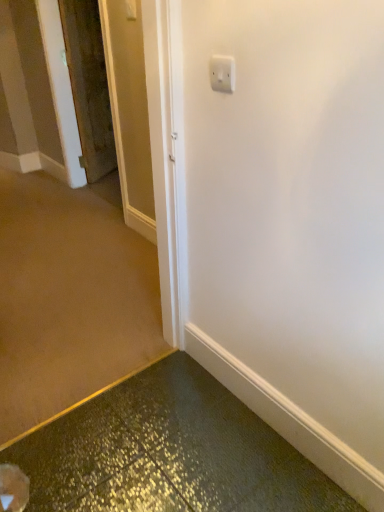
Find the location of a particular element. Image resolution: width=384 pixels, height=512 pixels. white plastic light switch at upper center is located at coordinates (222, 73).

What is the approximate width of white plastic light switch at upper center?

It is 1.42 centimeters.

What do you see at coordinates (222, 73) in the screenshot?
I see `white plastic light switch at upper center` at bounding box center [222, 73].

Where is `wooden door at left`? The width and height of the screenshot is (384, 512). wooden door at left is located at coordinates (89, 86).

Image resolution: width=384 pixels, height=512 pixels. What do you see at coordinates (89, 86) in the screenshot?
I see `wooden door at left` at bounding box center [89, 86].

At what (x,y) coordinates should I click in order to perform the action: click on white plastic light switch at upper center. Please return your answer as a coordinate pair (x, y). Looking at the image, I should click on (222, 73).

Can you confirm if wooden door at left is positioned to the left of white plastic light switch at upper center?

Correct, you'll find wooden door at left to the left of white plastic light switch at upper center.

Which object is further away from the camera taking this photo, wooden door at left or white plastic light switch at upper center?

wooden door at left.

Is point (98, 175) less distant than point (227, 85)?

No.

From the image's perspective, would you say wooden door at left is positioned over white plastic light switch at upper center?

Yes, from the image's perspective, wooden door at left is above white plastic light switch at upper center.

From a real-world perspective, is wooden door at left above or below white plastic light switch at upper center?

In terms of real-world spatial position, wooden door at left is below white plastic light switch at upper center.

Which of these two, wooden door at left or white plastic light switch at upper center, is wider?

Wider between the two is wooden door at left.

Between wooden door at left and white plastic light switch at upper center, which one has less height?

Standing shorter between the two is white plastic light switch at upper center.

Considering the relative sizes of wooden door at left and white plastic light switch at upper center in the image provided, is wooden door at left smaller than white plastic light switch at upper center?

Incorrect, wooden door at left is not smaller in size than white plastic light switch at upper center.

Is wooden door at left situated inside white plastic light switch at upper center or outside?

wooden door at left is spatially situated outside white plastic light switch at upper center.

Is wooden door at left far from white plastic light switch at upper center?

That's right, there is a large distance between wooden door at left and white plastic light switch at upper center.

Could you tell me if wooden door at left is facing white plastic light switch at upper center?

No, wooden door at left is not aimed at white plastic light switch at upper center.

What's the angular difference between wooden door at left and white plastic light switch at upper center's facing directions?

wooden door at left and white plastic light switch at upper center are facing 120 degrees away from each other.

How far apart are wooden door at left and white plastic light switch at upper center?

wooden door at left and white plastic light switch at upper center are 8.50 feet apart.

I want to click on door on the left of white plastic light switch at upper center, so click(x=89, y=86).

Which is more to the left, white plastic light switch at upper center or wooden door at left?

Positioned to the left is wooden door at left.

Does white plastic light switch at upper center lie in front of wooden door at left?

Yes, the depth of white plastic light switch at upper center is less than that of wooden door at left.

Considering the points (223, 87) and (111, 135), which point is behind, point (223, 87) or point (111, 135)?

The point (111, 135) is behind.

From the image's perspective, which is below, white plastic light switch at upper center or wooden door at left?

white plastic light switch at upper center.

From a real-world perspective, is white plastic light switch at upper center located higher than wooden door at left?

Correct, in the physical world, white plastic light switch at upper center is higher than wooden door at left.

Considering the sizes of white plastic light switch at upper center and wooden door at left in the image, is white plastic light switch at upper center wider or thinner than wooden door at left?

white plastic light switch at upper center is thinner than wooden door at left.

Between white plastic light switch at upper center and wooden door at left, which one has less height?

white plastic light switch at upper center is shorter.

From the picture: Based on their sizes in the image, would you say white plastic light switch at upper center is bigger or smaller than wooden door at left?

Considering their sizes, white plastic light switch at upper center takes up less space than wooden door at left.

Would you say white plastic light switch at upper center is inside or outside wooden door at left?

The correct answer is: outside.

Is white plastic light switch at upper center next to wooden door at left?

No, white plastic light switch at upper center is not touching wooden door at left.

Is white plastic light switch at upper center looking in the opposite direction of wooden door at left?

white plastic light switch at upper center does not have its back to wooden door at left.

Measure the distance between white plastic light switch at upper center and wooden door at left.

white plastic light switch at upper center and wooden door at left are 2.59 meters apart from each other.

This screenshot has width=384, height=512. I want to click on door that appears behind the white plastic light switch at upper center, so click(x=89, y=86).

Where is `door behind the white plastic light switch at upper center`? The image size is (384, 512). door behind the white plastic light switch at upper center is located at coordinates (89, 86).

Locate an element on the screen. This screenshot has height=512, width=384. light switch that appears above the wooden door at left (from a real-world perspective) is located at coordinates (222, 73).